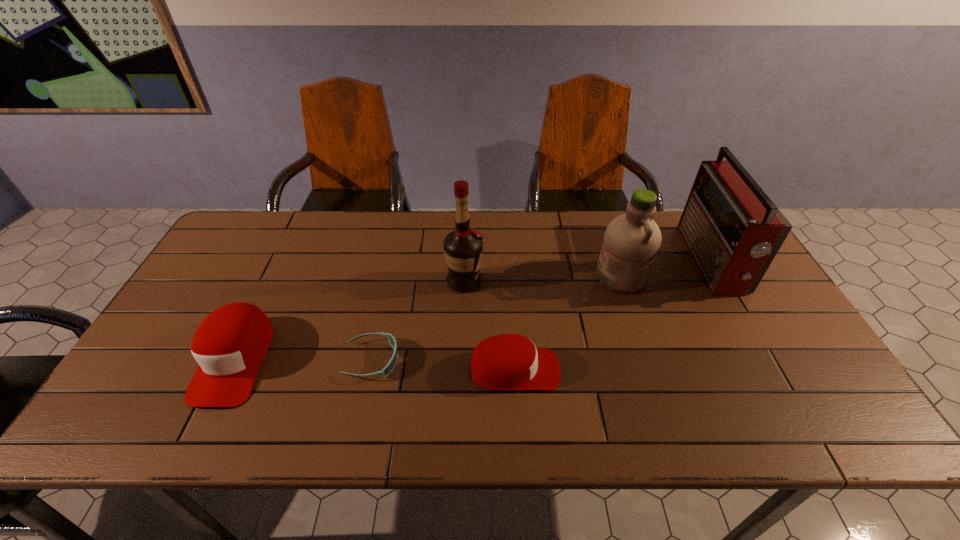
At what (x,y) coordinates should I click in order to perform the action: click on object identified as the fifth closest to the shorter baseball cap. Please return your answer as a coordinate pair (x, y). Looking at the image, I should click on (230, 344).

The image size is (960, 540). I want to click on object that stands as the fifth closest to the right baseball cap, so click(x=230, y=344).

Find the location of a particular element. vacant space that satisfies the following two spatial constraints: 1. on the front-facing side of the radio receiver; 2. on the front-facing side of the fourth tallest object is located at coordinates (767, 360).

The image size is (960, 540). Identify the location of vacant space that satisfies the following two spatial constraints: 1. on the front label of the fifth object from left to right; 2. on the front-facing side of the left baseball cap. (649, 360).

Where is `vacant space that satisfies the following two spatial constraints: 1. on the front label of the fifth object from left to right; 2. on the front-facing side of the third shortest object`? This screenshot has height=540, width=960. vacant space that satisfies the following two spatial constraints: 1. on the front label of the fifth object from left to right; 2. on the front-facing side of the third shortest object is located at coordinates (649, 360).

This screenshot has height=540, width=960. In order to click on free space that satisfies the following two spatial constraints: 1. on the front and back of the liquor; 2. on the front-facing side of the fourth tallest object in this screenshot , I will do `click(462, 360)`.